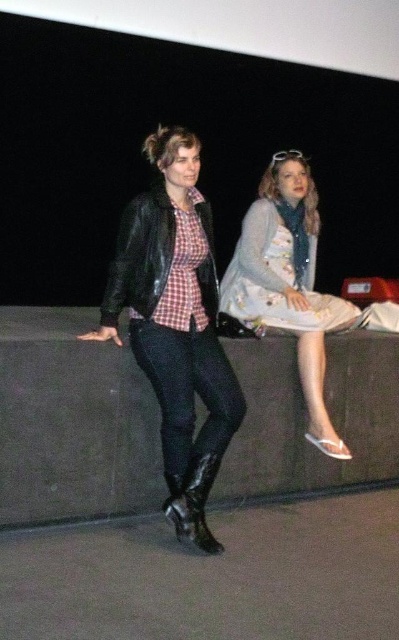
Question: From the image, what is the correct spatial relationship of matte black leather jacket at left in relation to glossy leather boot at lower left?

Choices:
 (A) left
 (B) right

Answer: (A)

Question: Among these objects, which one is farthest from the camera?

Choices:
 (A) floral dress at center
 (B) glossy leather boot at lower left
 (C) matte black leather jacket at left

Answer: (A)

Question: Does floral dress at center appear over glossy leather boot at lower left?

Choices:
 (A) yes
 (B) no

Answer: (A)

Question: Which point is closer to the camera?

Choices:
 (A) glossy leather boot at lower left
 (B) floral dress at center
 (C) matte black leather jacket at left

Answer: (A)

Question: Observing the image, what is the correct spatial positioning of matte black leather jacket at left in reference to floral dress at center?

Choices:
 (A) below
 (B) above

Answer: (A)

Question: Among these points, which one is farthest from the camera?

Choices:
 (A) (146, 342)
 (B) (211, 534)
 (C) (276, 272)

Answer: (C)